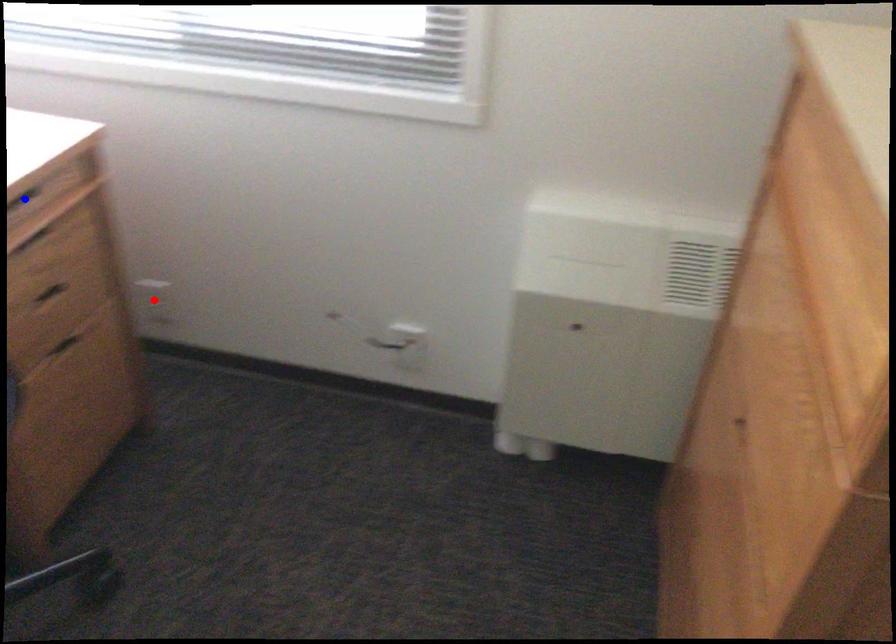
Question: Two points are marked on the image. Which point is closer to the camera?

Choices:
 (A) Blue point is closer.
 (B) Red point is closer.

Answer: (A)